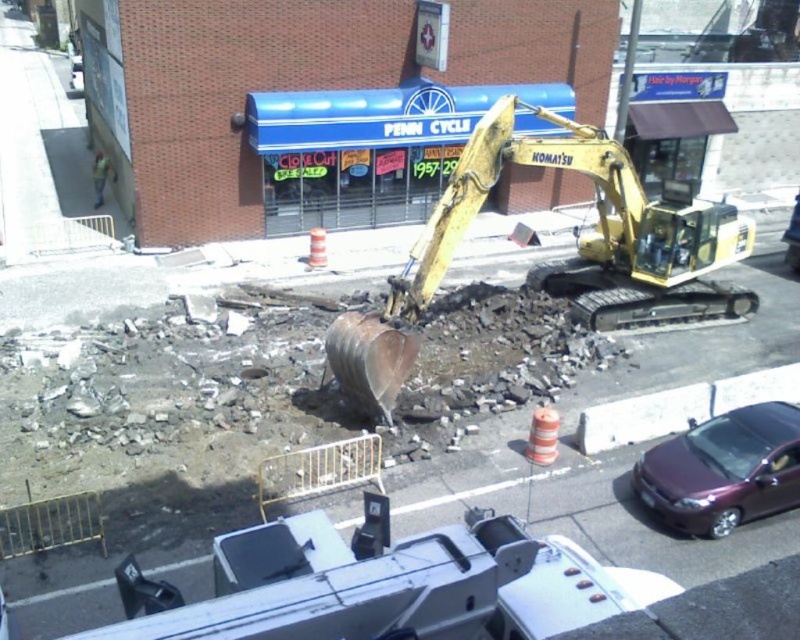
In the scene shown: Is blue awning at center below yellow reflective vest at left?

Actually, blue awning at center is above yellow reflective vest at left.

Is blue awning at center behind yellow reflective vest at left?

That is False.

Is point (436, 202) more distant than point (100, 179)?

No, it is not.

Locate an element on the screen. The image size is (800, 640). blue awning at center is located at coordinates (368, 148).

Image resolution: width=800 pixels, height=640 pixels. What do you see at coordinates (556, 260) in the screenshot?
I see `yellow metallic excavator at center` at bounding box center [556, 260].

From the picture: Can you confirm if yellow metallic excavator at center is taller than yellow reflective vest at left?

Yes.

Does point (474, 145) come farther from viewer compared to point (106, 163)?

That is False.

Locate an element on the screen. yellow metallic excavator at center is located at coordinates (556, 260).

Is yellow metallic excavator at center above blue awning at center?

No.

Who is lower down, yellow metallic excavator at center or blue awning at center?

yellow metallic excavator at center

Is point (462, 211) behind point (308, 163)?

No, it is not.

Where is `yellow metallic excavator at center`? This screenshot has height=640, width=800. yellow metallic excavator at center is located at coordinates (556, 260).